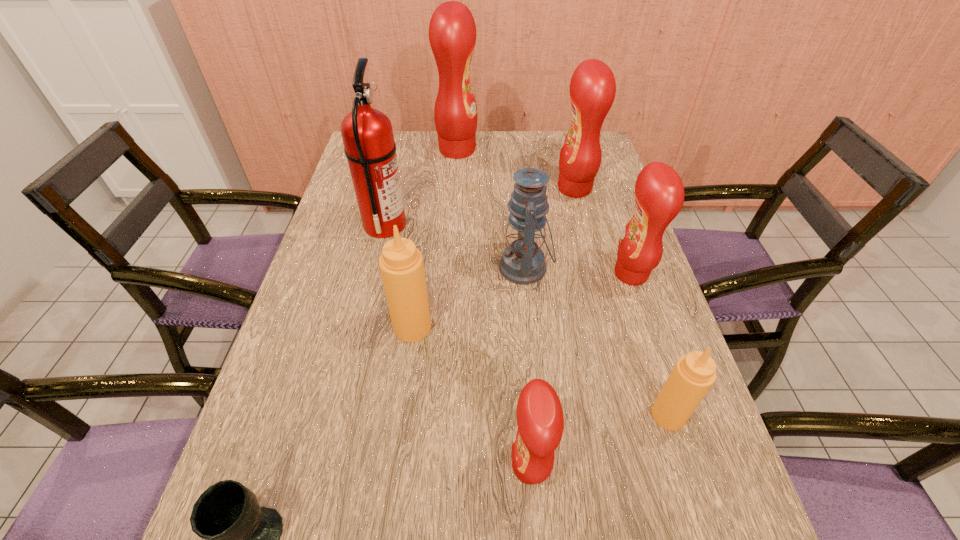
Identify the location of object situated at the far edge. (452, 31).

I want to click on object situated at the left edge, so click(367, 133).

Identify the location of free region at the far edge. The height and width of the screenshot is (540, 960). (516, 163).

Locate an element on the screen. free space at the left edge of the desktop is located at coordinates (327, 337).

What are the coordinates of `vacant position at the right edge of the desktop` in the screenshot? It's located at (576, 208).

Find the location of a particular element. The height and width of the screenshot is (540, 960). free space at the far left corner of the desktop is located at coordinates (403, 147).

Where is `vacant space that's between the third farthest red condiment and the third red condiment from right to left`? Image resolution: width=960 pixels, height=540 pixels. vacant space that's between the third farthest red condiment and the third red condiment from right to left is located at coordinates (581, 370).

Locate an element on the screen. The height and width of the screenshot is (540, 960). vacant space in between the second tallest condiment and the fourth condiment from right to left is located at coordinates (552, 328).

At what (x,y) coordinates should I click in order to perform the action: click on vacant space that is in between the right tan condiment and the fourth nearest condiment. Please return your answer as a coordinate pair (x, y). This screenshot has height=540, width=960. Looking at the image, I should click on (650, 345).

What are the coordinates of `vacant area that lies between the red fire extinguisher and the third nearest red condiment` in the screenshot? It's located at (480, 207).